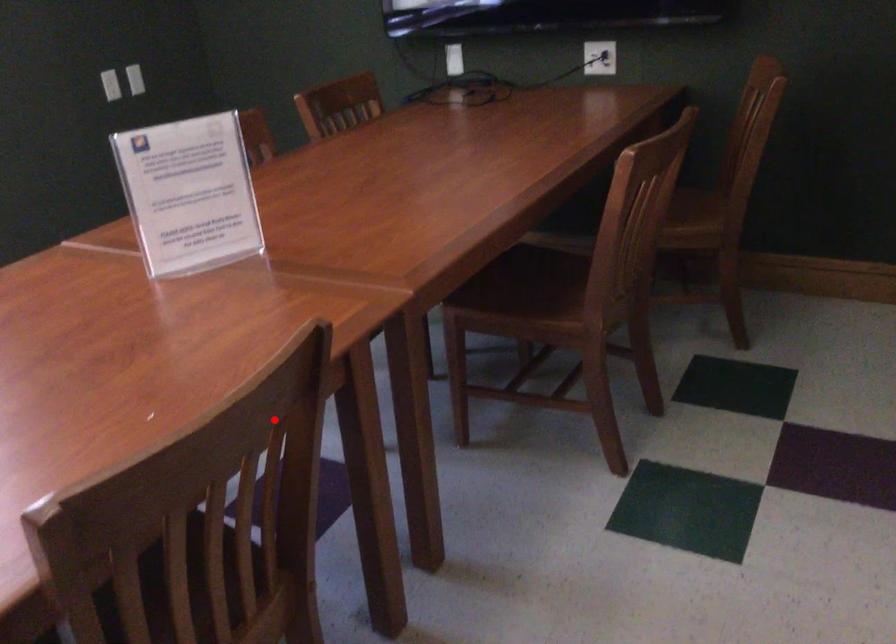
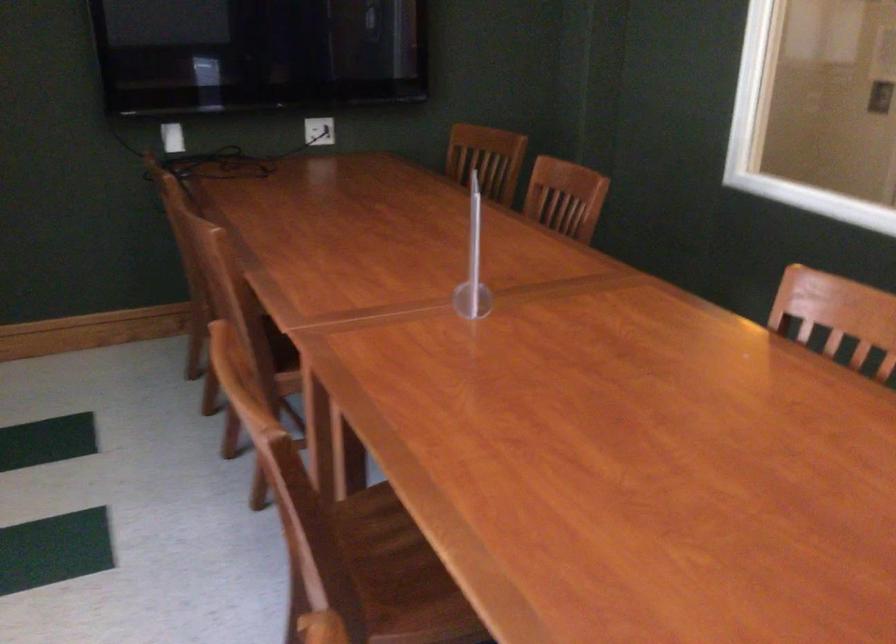
Question: I am providing you with two images of the same scene from different viewpoints. Given a red point in image1, look at the same physical point in image2. Is it:

Choices:
 (A) Closer to the viewpoint
 (B) Farther from the viewpoint

Answer: (B)